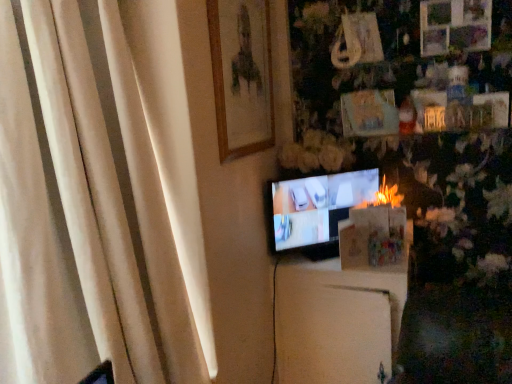
Question: Does wooden framed portrait at upper center appear on the right side of matte black tv at center?

Choices:
 (A) no
 (B) yes

Answer: (A)

Question: Does wooden framed portrait at upper center have a smaller size compared to matte black tv at center?

Choices:
 (A) yes
 (B) no

Answer: (A)

Question: Is matte black tv at center at the back of wooden framed portrait at upper center?

Choices:
 (A) no
 (B) yes

Answer: (A)

Question: Is wooden framed portrait at upper center positioned beyond the bounds of matte black tv at center?

Choices:
 (A) yes
 (B) no

Answer: (A)

Question: Is wooden framed portrait at upper center positioned far away from matte black tv at center?

Choices:
 (A) yes
 (B) no

Answer: (B)

Question: Considering the positions of wooden framed portrait at upper center and matte black tv at center in the image, is wooden framed portrait at upper center bigger or smaller than matte black tv at center?

Choices:
 (A) small
 (B) big

Answer: (A)

Question: Relative to matte black tv at center, is wooden framed portrait at upper center in front or behind?

Choices:
 (A) front
 (B) behind

Answer: (A)

Question: From a real-world perspective, is wooden framed portrait at upper center physically located above or below matte black tv at center?

Choices:
 (A) above
 (B) below

Answer: (A)

Question: From their relative heights in the image, would you say wooden framed portrait at upper center is taller or shorter than matte black tv at center?

Choices:
 (A) short
 (B) tall

Answer: (B)

Question: From the image's perspective, relative to wooden framed portrait at upper center, is white fabric curtain at left above or below?

Choices:
 (A) above
 (B) below

Answer: (B)

Question: Considering the positions of white fabric curtain at left and wooden framed portrait at upper center in the image, is white fabric curtain at left wider or thinner than wooden framed portrait at upper center?

Choices:
 (A) thin
 (B) wide

Answer: (B)

Question: Is white fabric curtain at left bigger or smaller than wooden framed portrait at upper center?

Choices:
 (A) small
 (B) big

Answer: (B)

Question: Considering the positions of point (32, 326) and point (209, 11), is point (32, 326) closer or farther from the camera than point (209, 11)?

Choices:
 (A) farther
 (B) closer

Answer: (B)

Question: From the image's perspective, is white fabric curtain at left above or below matte black tv at center?

Choices:
 (A) below
 (B) above

Answer: (A)

Question: Is white fabric curtain at left situated inside matte black tv at center or outside?

Choices:
 (A) inside
 (B) outside

Answer: (B)